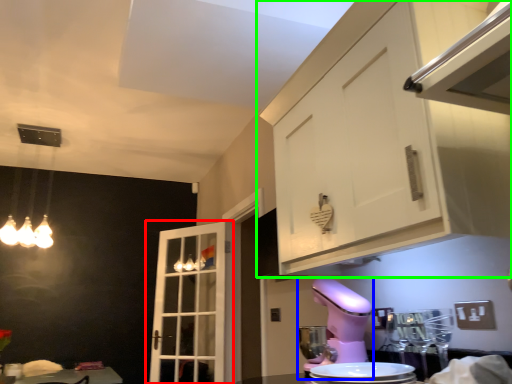
Question: Based on their relative distances, which object is nearer to door (highlighted by a red box)? Choose from mixer (highlighted by a blue box) and cabinetry (highlighted by a green box).

Choices:
 (A) mixer
 (B) cabinetry

Answer: (A)